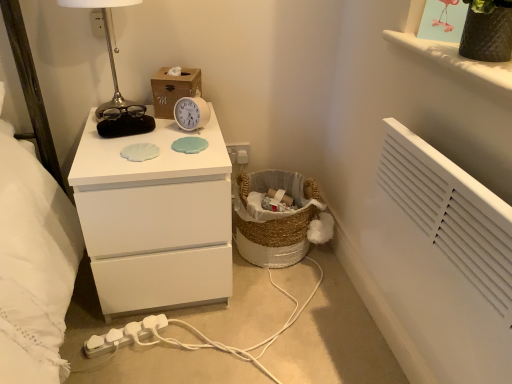
Question: Do you think textured brown vase at upper right is within white plastic electric outlet at upper center, or outside of it?

Choices:
 (A) inside
 (B) outside

Answer: (B)

Question: From a real-world perspective, is textured brown vase at upper right above or below white plastic electric outlet at upper center?

Choices:
 (A) below
 (B) above

Answer: (B)

Question: Which object is the closest to the white plastic alarm clock at center?

Choices:
 (A) woven natural basket at lower center
 (B) white plastic extension cord at lower left
 (C) white matte chest of drawers at center
 (D) matte black vase at upper right
 (E) white plastic electric outlet at upper center

Answer: (C)

Question: Which of these objects is positioned closest to the matte black vase at upper right?

Choices:
 (A) white plastic electric outlet at upper center
 (B) metallic silver table lamp at upper left
 (C) wooden tissue box at upper center
 (D) textured brown vase at upper right
 (E) white matte chest of drawers at center

Answer: (D)